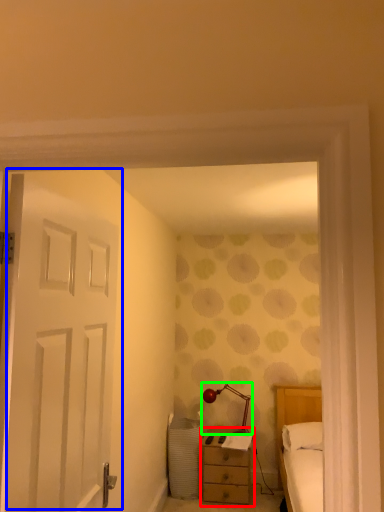
Question: Considering the real-world distances, which object is farthest from nightstand (highlighted by a red box)? door (highlighted by a blue box) or table lamp (highlighted by a green box)?

Choices:
 (A) door
 (B) table lamp

Answer: (A)